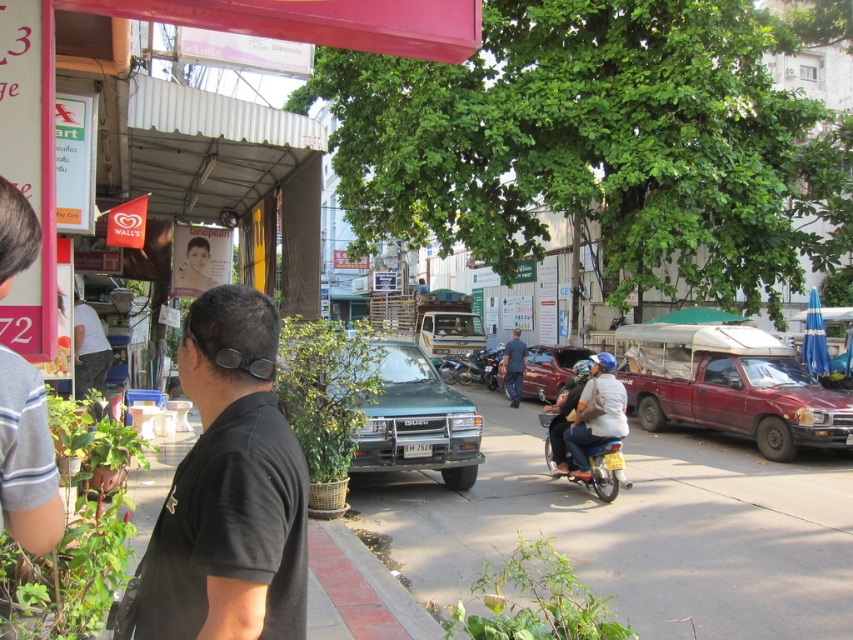
You are standing on the street and want to walk towards both the point at coordinates [550,435] and the point at coordinates [509,387]. Which point will you reach first?

You will reach point [550,435] first because it is closer to you than point [509,387].

You are standing at the point marked by the coordinates point (639, 529) in the image. What is the material of the surface you are currently standing on?

The surface at point (639, 529) is green asphalt pavement at center.